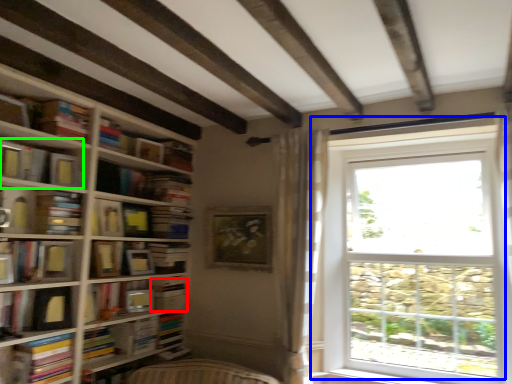
Question: Based on their relative distances, which object is farther from paperback book (highlighted by a red box)? Choose from window (highlighted by a blue box) and book (highlighted by a green box).

Choices:
 (A) window
 (B) book

Answer: (A)